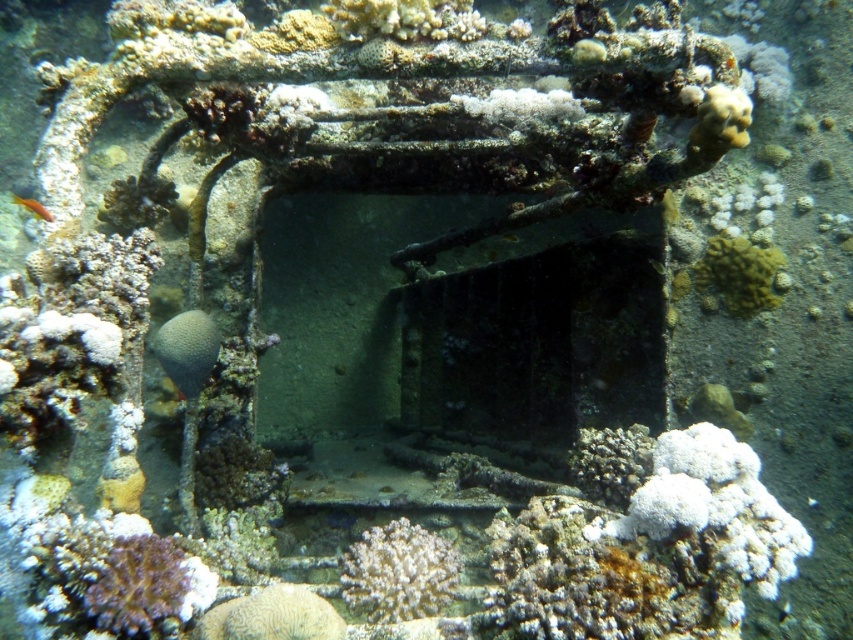
Question: Which point is farther to the camera?

Choices:
 (A) (740, 282)
 (B) (173, 323)

Answer: (A)

Question: Which object is farther from the camera taking this photo?

Choices:
 (A) orange matte fish at lower left
 (B) white coral at center
 (C) gray matte coral at center

Answer: (C)

Question: Is white coral at center positioned at the back of orange matte fish at lower left?

Choices:
 (A) yes
 (B) no

Answer: (B)

Question: Estimate the real-world distances between objects in this image. Which object is closer to the orange matte fish at lower left?

Choices:
 (A) white coral at center
 (B) gray matte coral at center
 (C) yellow coral at center

Answer: (B)

Question: Is yellow coral at center below orange matte fish at lower left?

Choices:
 (A) no
 (B) yes

Answer: (B)

Question: In this image, where is white coral at center located relative to yellow coral at center?

Choices:
 (A) right
 (B) left

Answer: (B)